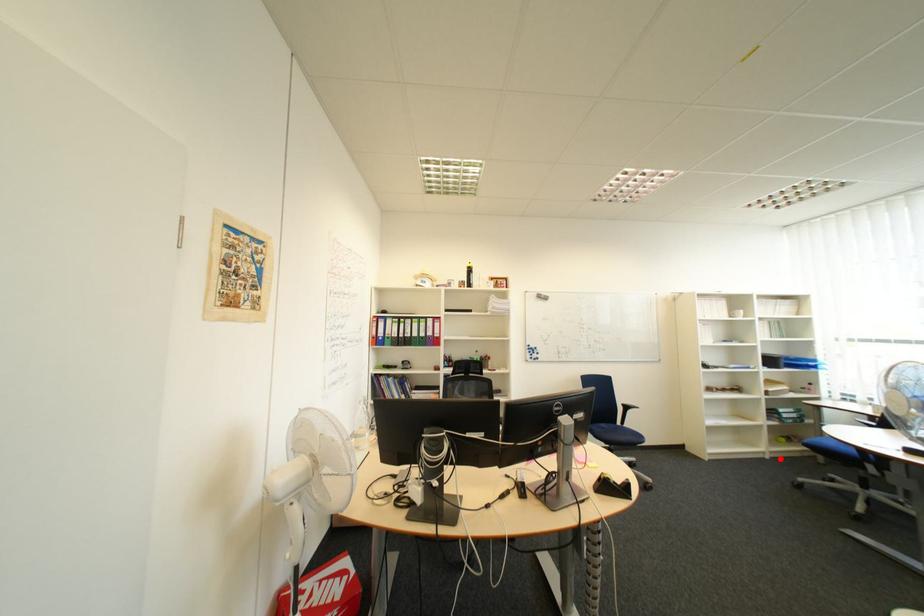
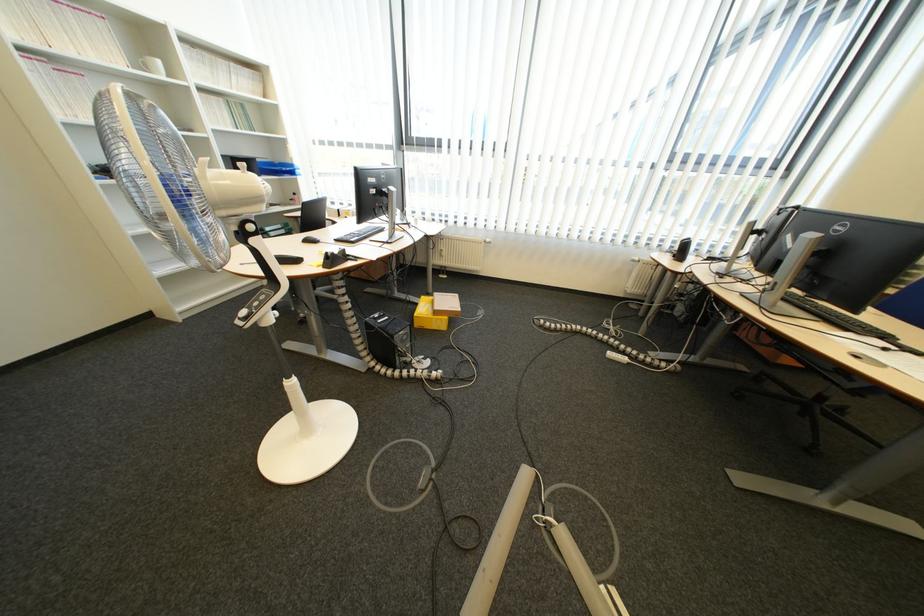
Question: I am providing you with two images of the same scene from different viewpoints. In image1, a red point is highlighted. Considering the same 3D point in image2, which of the following is correct?

Choices:
 (A) It is closer
 (B) It is farther

Answer: (B)